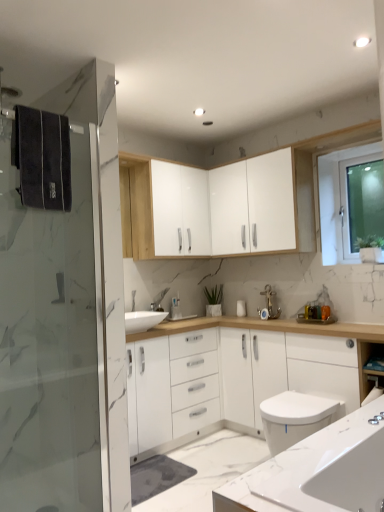
Question: Does white glossy cabinet at upper center, which is the 2th cabinetry in right-to-left order, have a lesser width compared to white glossy cabinet at upper center, the first cabinetry from the right?

Choices:
 (A) no
 (B) yes

Answer: (B)

Question: Does white glossy cabinet at upper center, which is the 2th cabinetry in right-to-left order, have a greater width compared to white glossy cabinet at upper center, positioned as the 2th cabinetry in left-to-right order?

Choices:
 (A) yes
 (B) no

Answer: (B)

Question: Is white glossy cabinet at upper center, which is the 2th cabinetry in right-to-left order, facing away from white glossy cabinet at upper center, the first cabinetry from the right?

Choices:
 (A) yes
 (B) no

Answer: (B)

Question: Considering the relative positions of white glossy cabinet at upper center, the 1th cabinetry when ordered from left to right, and white glossy cabinet at upper center, the first cabinetry from the right, in the image provided, is white glossy cabinet at upper center, the 1th cabinetry when ordered from left to right, to the left of white glossy cabinet at upper center, the first cabinetry from the right, from the viewer's perspective?

Choices:
 (A) yes
 (B) no

Answer: (A)

Question: Is the position of white glossy cabinet at upper center, which is the 2th cabinetry in right-to-left order, more distant than that of white glossy cabinet at upper center, positioned as the 2th cabinetry in left-to-right order?

Choices:
 (A) no
 (B) yes

Answer: (B)

Question: From a real-world perspective, is transparent glass window at upper right positioned above or below white glossy cabinet at upper center, the first cabinetry from the right?

Choices:
 (A) below
 (B) above

Answer: (A)

Question: Considering the positions of transparent glass window at upper right and white glossy cabinet at upper center, the first cabinetry from the right, in the image, is transparent glass window at upper right wider or thinner than white glossy cabinet at upper center, the first cabinetry from the right,?

Choices:
 (A) wide
 (B) thin

Answer: (B)

Question: Do you think transparent glass window at upper right is within white glossy cabinet at upper center, positioned as the 2th cabinetry in left-to-right order, or outside of it?

Choices:
 (A) inside
 (B) outside

Answer: (B)

Question: Is transparent glass window at upper right taller or shorter than white glossy cabinet at upper center, the first cabinetry from the right?

Choices:
 (A) tall
 (B) short

Answer: (A)

Question: Is white glossy cabinet at upper center, positioned as the 2th cabinetry in left-to-right order, in front of or behind white glossy cabinet at lower right in the image?

Choices:
 (A) front
 (B) behind

Answer: (B)

Question: From a real-world perspective, is white glossy cabinet at upper center, the first cabinetry from the right, physically located above or below white glossy cabinet at lower right?

Choices:
 (A) above
 (B) below

Answer: (A)

Question: Is white glossy cabinet at upper center, the first cabinetry from the right, to the left or to the right of white glossy cabinet at lower right in the image?

Choices:
 (A) right
 (B) left

Answer: (B)

Question: Looking at their shapes, would you say white glossy cabinet at upper center, the first cabinetry from the right, is wider or thinner than white glossy cabinet at lower right?

Choices:
 (A) wide
 (B) thin

Answer: (B)

Question: Is white glossy cabinet at upper center, which is the 2th cabinetry in right-to-left order, bigger or smaller than white marble countertop at lower right?

Choices:
 (A) small
 (B) big

Answer: (A)

Question: Is point (173, 185) positioned closer to the camera than point (359, 477)?

Choices:
 (A) farther
 (B) closer

Answer: (A)